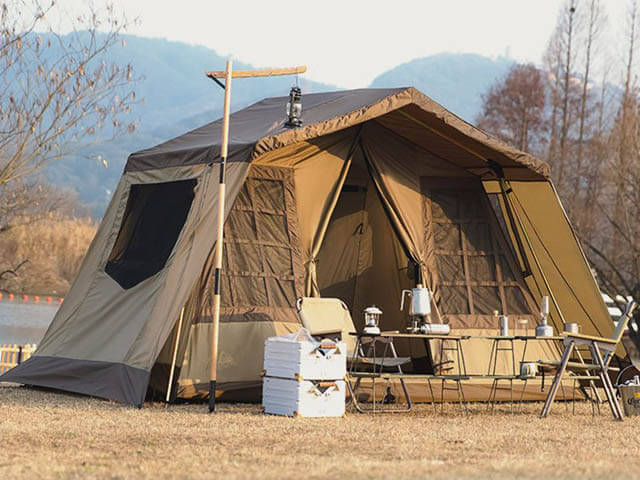
The image size is (640, 480). In order to click on lantern in this screenshot , I will do `click(292, 109)`.